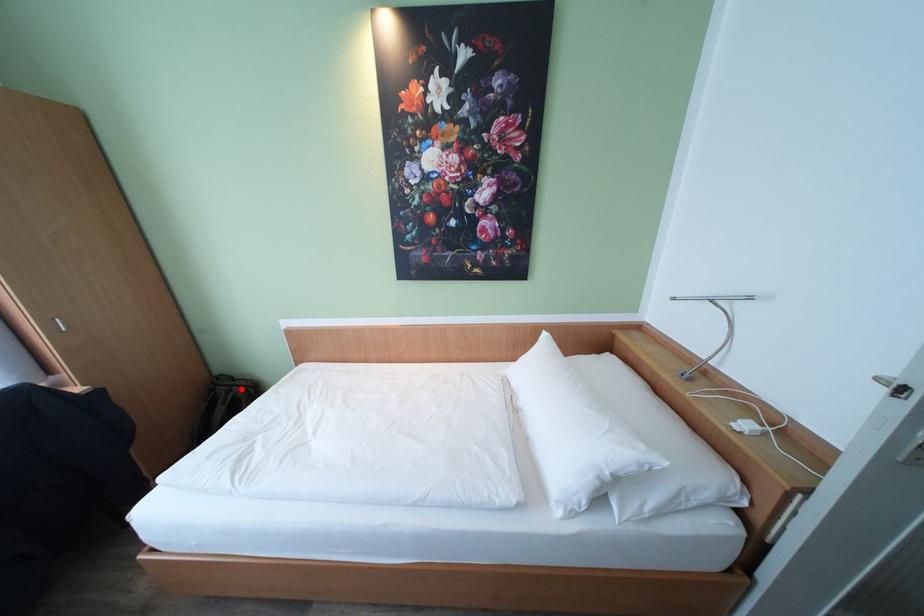
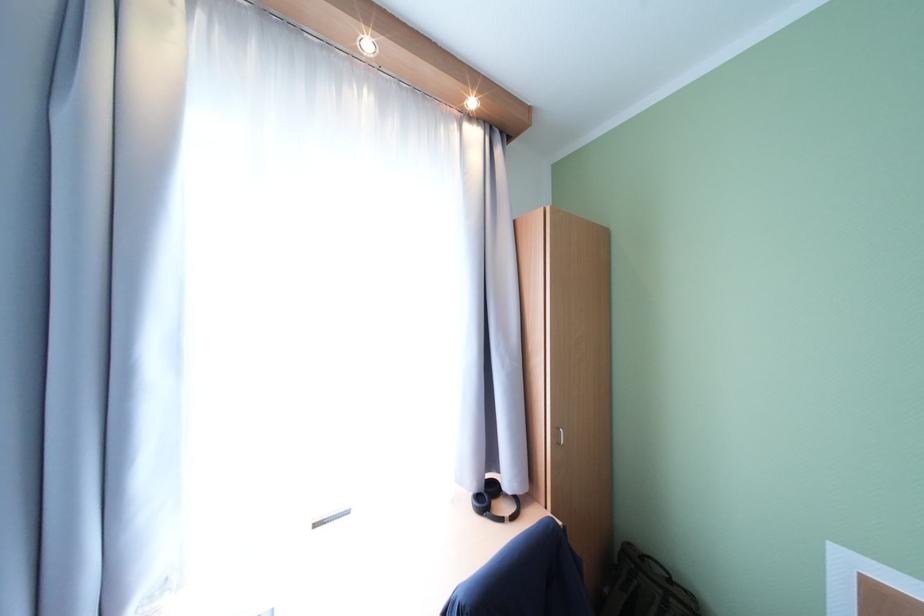
Question: I am providing you with two images of the same scene from different viewpoints. Given a red point in image1, look at the same physical point in image2. Is it:

Choices:
 (A) Closer to the viewpoint
 (B) Farther from the viewpoint

Answer: (A)